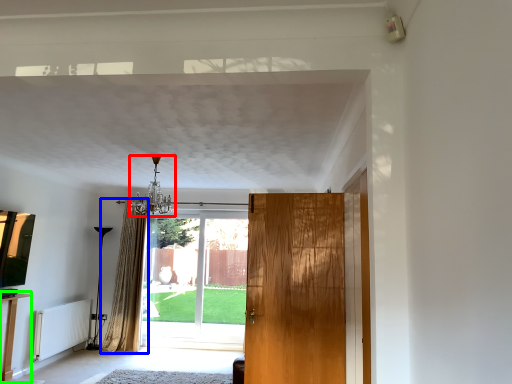
Question: Considering the real-world distances, which object is farthest from light fixture (highlighted by a red box)? curtain (highlighted by a blue box) or table (highlighted by a green box)?

Choices:
 (A) curtain
 (B) table

Answer: (B)